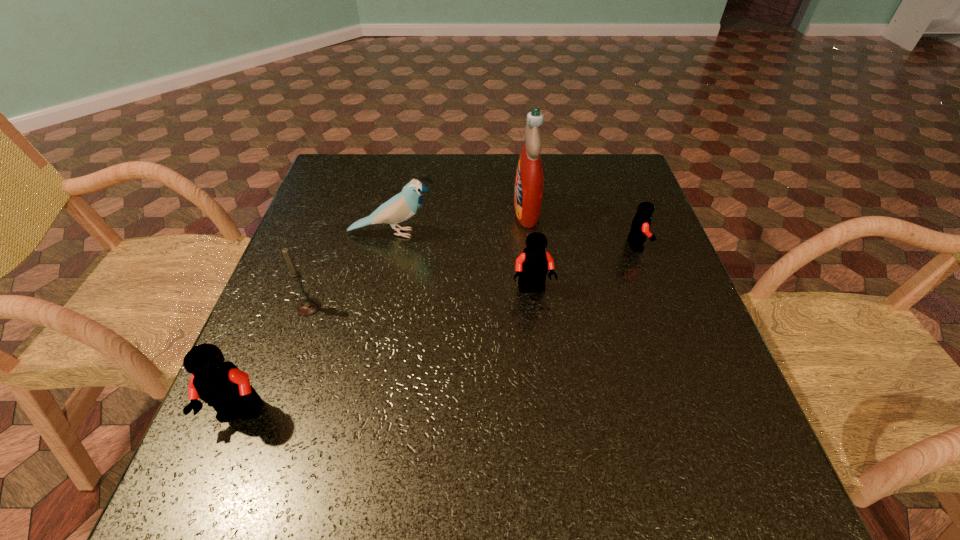
Where is `free space that is in between the leftmost Lego and the third object from left to right`? free space that is in between the leftmost Lego and the third object from left to right is located at coordinates (317, 324).

Find the location of a particular element. Image resolution: width=960 pixels, height=540 pixels. vacant space that's between the tallest object and the fourth object from right to left is located at coordinates click(x=460, y=222).

You are a GUI agent. You are given a task and a screenshot of the screen. Output one action in this format:
    pyautogui.click(x=<x>, y=<y>)
    Task: Click on the free space that is in between the candle and the farthest Lego
    This screenshot has height=540, width=960.
    Given the screenshot: What is the action you would take?
    coord(472,276)

Locate an element on the screen. free space that is in between the second farthest Lego and the bird is located at coordinates (463, 261).

Find the location of a particular element. This screenshot has height=540, width=960. free space that is in between the candle and the third object from left to right is located at coordinates (350, 270).

You are a GUI agent. You are given a task and a screenshot of the screen. Output one action in this format:
    pyautogui.click(x=<x>, y=<y>)
    Task: Click on the vacant space in between the rightmost object and the nearest object
    
    Given the screenshot: What is the action you would take?
    point(439,329)

This screenshot has width=960, height=540. I want to click on vacant space in between the rightmost Lego and the candle, so click(472, 276).

This screenshot has width=960, height=540. Identify the location of blank region between the nearest object and the shortest object. (439, 329).

Locate which object is the third closest to the detergent. Please provide its 2D coordinates. Your answer should be formatted as a tuple, i.e. [(x, y)], where the tuple contains the x and y coordinates of a point satisfying the conditions above.

[(640, 226)]

Select which object appears as the second closest to the third object from left to right. Please provide its 2D coordinates. Your answer should be formatted as a tuple, i.e. [(x, y)], where the tuple contains the x and y coordinates of a point satisfying the conditions above.

[(528, 192)]